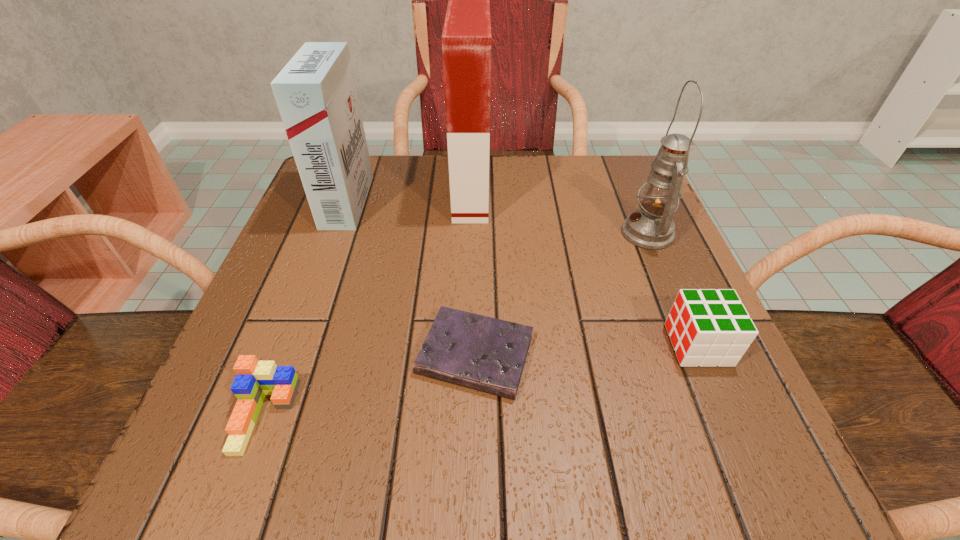
Find the location of a particular element. This screenshot has width=960, height=540. vacant region that satisfies the following two spatial constraints: 1. on the front-facing side of the taller cigarette case; 2. on the left side of the shortest object is located at coordinates (467, 355).

Locate an element on the screen. vacant position in the image that satisfies the following two spatial constraints: 1. on the front-facing side of the shortest object; 2. on the right side of the taller cigarette case is located at coordinates (467, 355).

You are a GUI agent. You are given a task and a screenshot of the screen. Output one action in this format:
    pyautogui.click(x=<x>, y=<y>)
    Task: Click on the free space in the image that satisfies the following two spatial constraints: 1. on the front-facing side of the taller cigarette case; 2. on the front side of the left cigarette case
    The width and height of the screenshot is (960, 540).
    Given the screenshot: What is the action you would take?
    pyautogui.click(x=470, y=202)